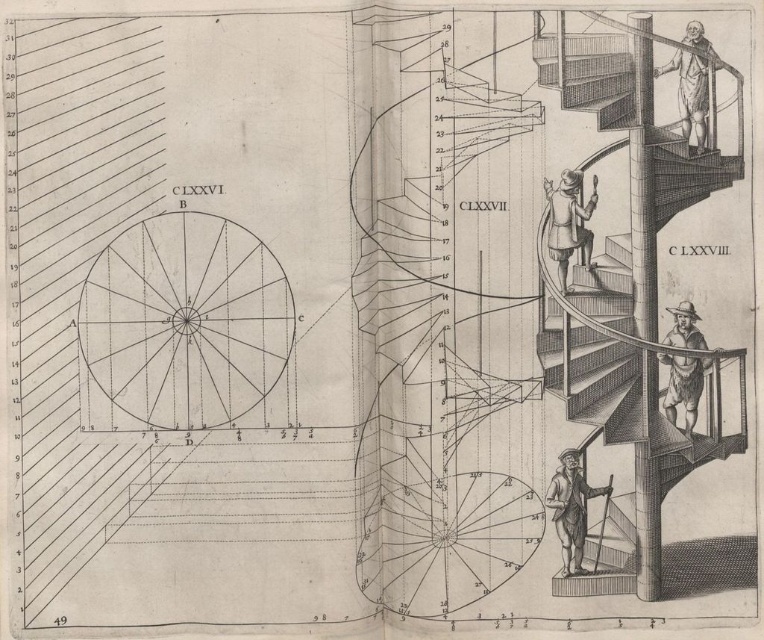
Is brown leather hat at center closer to the viewer compared to wooden staff at lower right?

Yes, it is in front of wooden staff at lower right.

Is brown leather hat at center below wooden staff at lower right?

No.

Does point (557, 193) come in front of point (562, 508)?

No, it is not.

Find the location of `brown leather hat at center`. brown leather hat at center is located at coordinates (568, 221).

Measure the distance between brown wood figure at upper right and camera.

brown wood figure at upper right and camera are 1.25 meters apart from each other.

Is point (695, 60) positioned in front of point (581, 476)?

Yes, point (695, 60) is closer to viewer.

Locate an element on the screen. brown wood figure at upper right is located at coordinates (694, 84).

Is wooden staircase at center to the right of brown wood figure at upper right from the viewer's perspective?

In fact, wooden staircase at center is to the left of brown wood figure at upper right.

Is point (544, 305) behind point (709, 54)?

That is True.

Is point (559, 300) in front of point (698, 45)?

No.

I want to click on wooden staircase at center, so click(x=594, y=342).